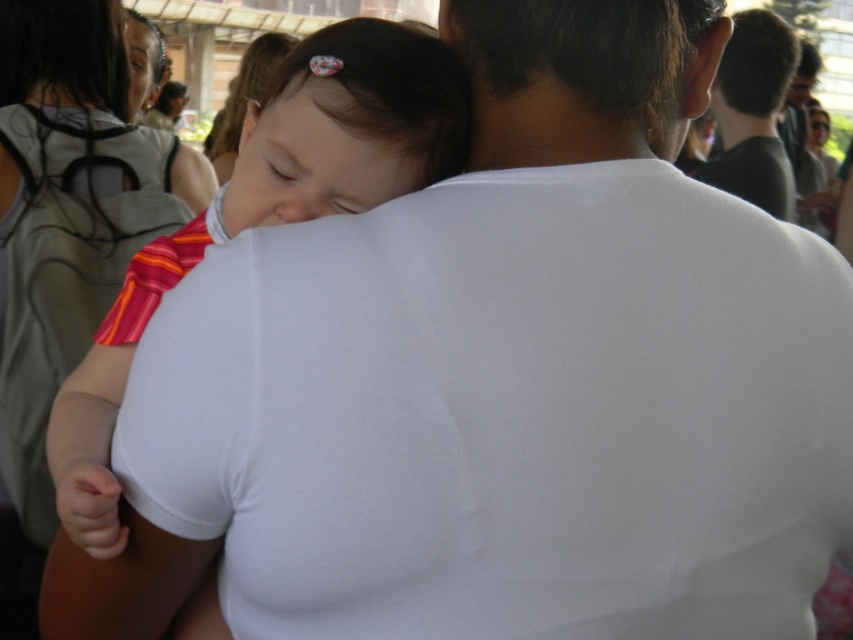
Can you confirm if matte white shirt at center is smaller than matte black hair at upper left?

Correct, matte white shirt at center occupies less space than matte black hair at upper left.

Which is in front, point (370, 45) or point (154, 61)?

Positioned in front is point (370, 45).

Find the location of a particular element. matte white shirt at center is located at coordinates (268, 216).

You are a GUI agent. You are given a task and a screenshot of the screen. Output one action in this format:
    pyautogui.click(x=<x>, y=<y>)
    Task: Click on the dark gray shirt at upper right
    Image resolution: width=853 pixels, height=640 pixels.
    Given the screenshot: What is the action you would take?
    pyautogui.click(x=804, y=141)

Can you confirm if dark gray shirt at upper right is shorter than matte black hair at upper left?

Yes.

This screenshot has height=640, width=853. What are the coordinates of `dark gray shirt at upper right` in the screenshot? It's located at (804, 141).

Does black matte hair at upper right appear over smooth brown hair at upper left?

No.

Looking at this image, is black matte hair at upper right shorter than smooth brown hair at upper left?

No, black matte hair at upper right is not shorter than smooth brown hair at upper left.

Is point (770, 106) positioned behind point (248, 44)?

No, it is in front of (248, 44).

The height and width of the screenshot is (640, 853). Find the location of `black matte hair at upper right`. black matte hair at upper right is located at coordinates (753, 113).